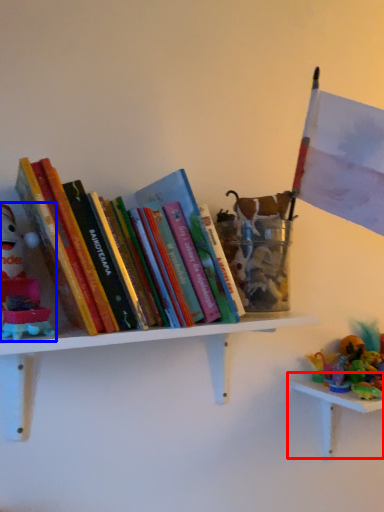
Question: Which object appears farthest to the camera in this image, table (highlighted by a red box) or toy (highlighted by a blue box)?

Choices:
 (A) table
 (B) toy

Answer: (A)